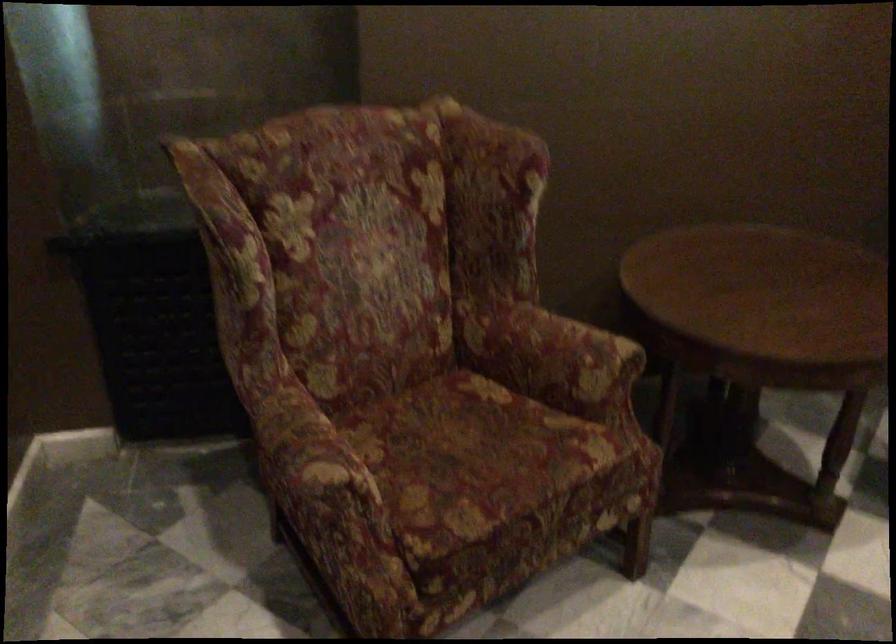
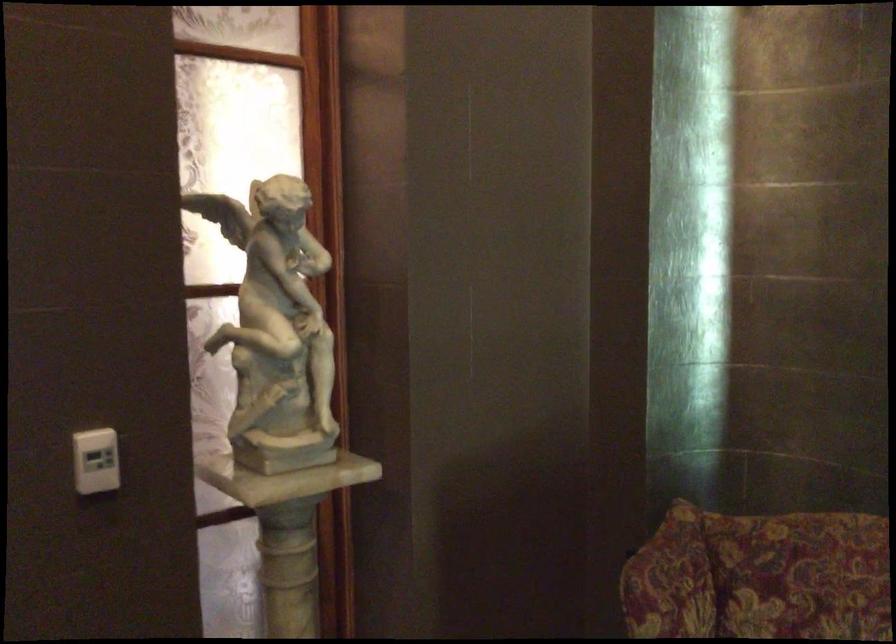
The point at (222, 198) is marked in the first image. Where is the corresponding point in the second image?

(670, 581)